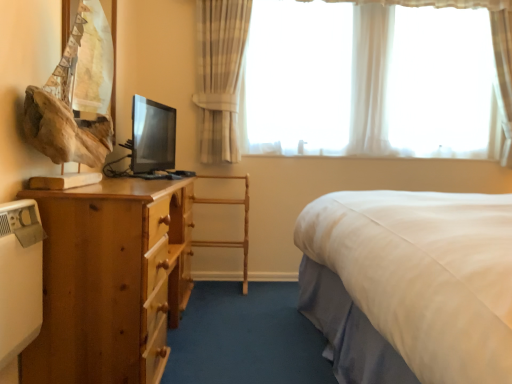
Question: Considering the relative positions of wooden chair at center and wooden drawer at lower left in the image provided, is wooden chair at center to the left or to the right of wooden drawer at lower left?

Choices:
 (A) right
 (B) left

Answer: (A)

Question: Relative to wooden drawer at lower left, is wooden chair at center in front or behind?

Choices:
 (A) behind
 (B) front

Answer: (A)

Question: Estimate the real-world distances between objects in this image. Which object is closer to the wooden chair at center?

Choices:
 (A) wooden nightstand at left
 (B) white sheer curtains at upper center
 (C) wooden drawer at lower left

Answer: (C)

Question: Which of these objects is positioned closest to the wooden chair at center?

Choices:
 (A) wooden nightstand at left
 (B) white sheer curtains at upper center
 (C) wooden drawer at lower left

Answer: (C)